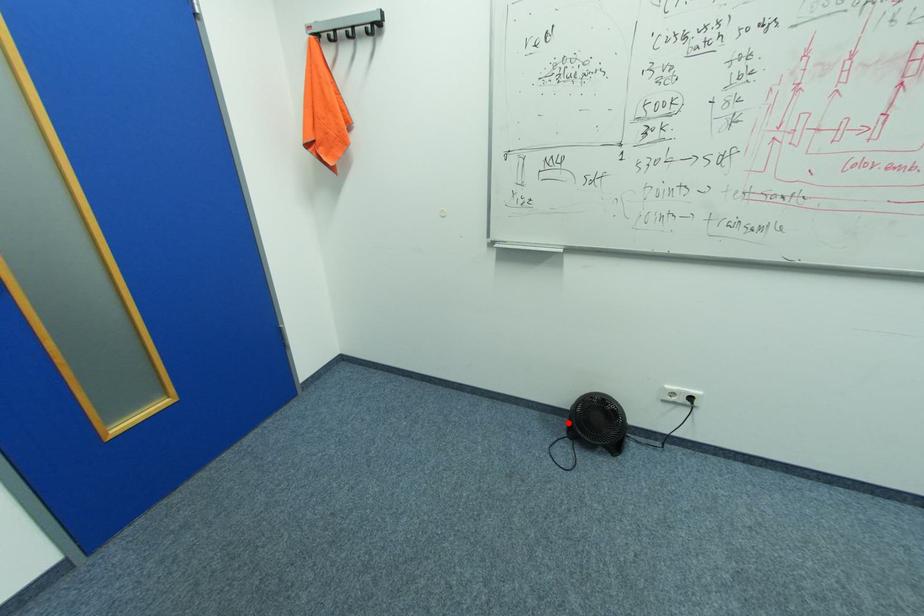
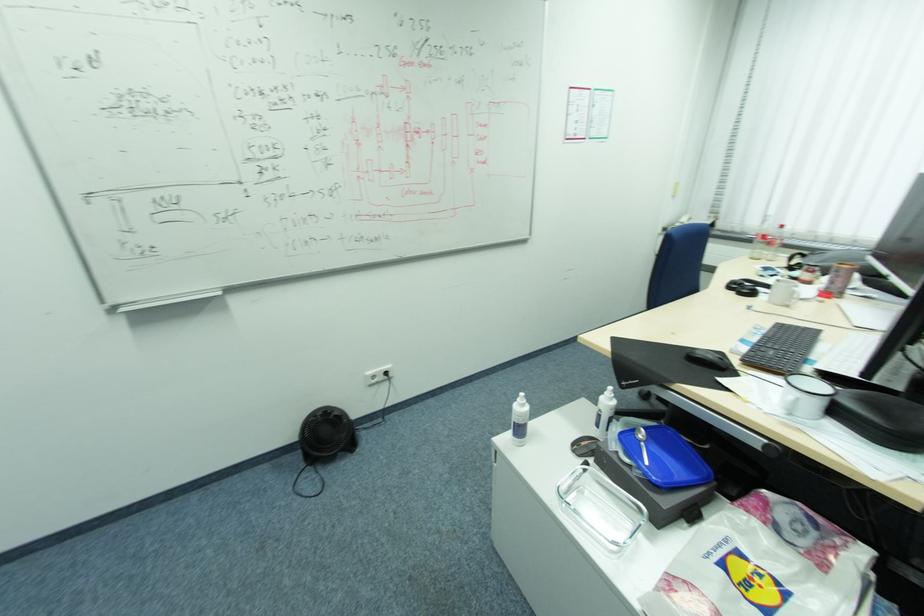
In the second image, find the point that corresponds to the highlighted location in the first image.

(304, 456)